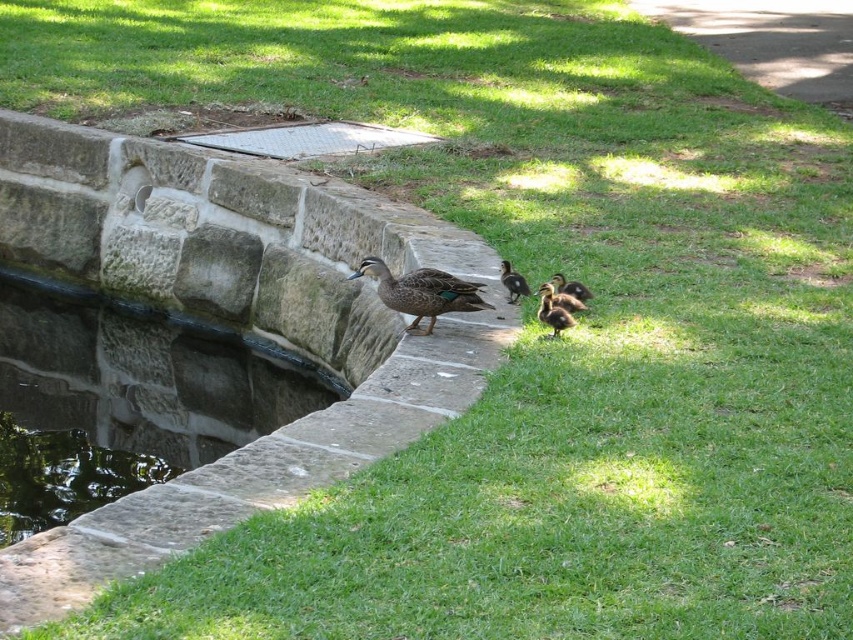
Question: Estimate the real-world distances between objects in this image. Which object is closer to the clear stone water at lower left?

Choices:
 (A) brown fuzzy duckling at lower center
 (B) brown speckled duck at center

Answer: (B)

Question: Which of these objects is positioned farthest from the brown fuzzy duckling at lower center?

Choices:
 (A) green glossy duckling at center
 (B) brown speckled duck at center
 (C) brown speckled ducklings at center

Answer: (B)

Question: Is brown speckled duck at center positioned at the back of brown speckled ducklings at center?

Choices:
 (A) no
 (B) yes

Answer: (B)

Question: From the image, what is the correct spatial relationship of brown fuzzy duckling at lower center in relation to green glossy duckling at center?

Choices:
 (A) below
 (B) above

Answer: (A)

Question: Does clear stone water at lower left lie in front of brown fuzzy duckling at lower center?

Choices:
 (A) yes
 (B) no

Answer: (B)

Question: Which of the following is the farthest from the observer?

Choices:
 (A) (506, 264)
 (B) (538, 289)
 (C) (550, 291)

Answer: (A)